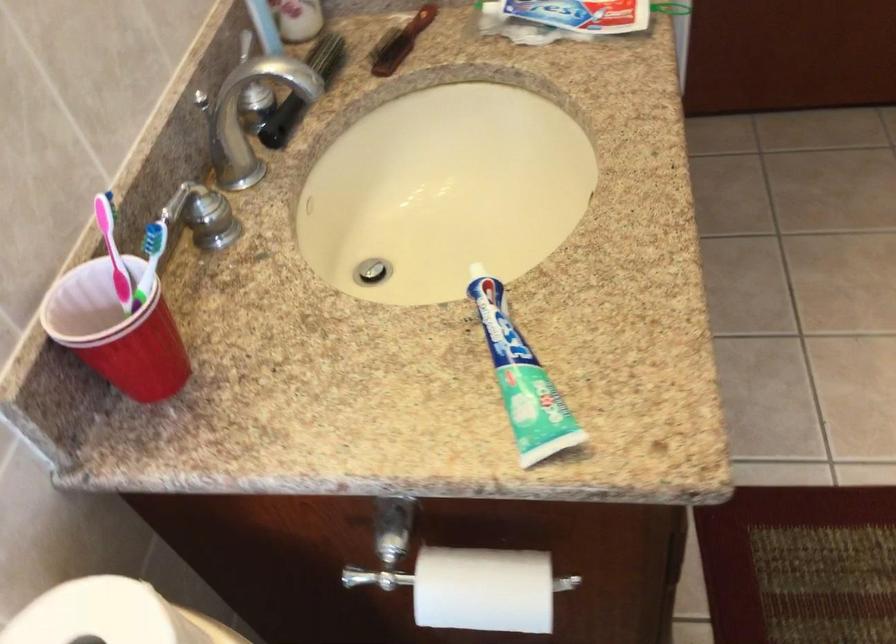
This screenshot has width=896, height=644. In order to click on white toilet lid in this screenshot , I will do `click(101, 614)`.